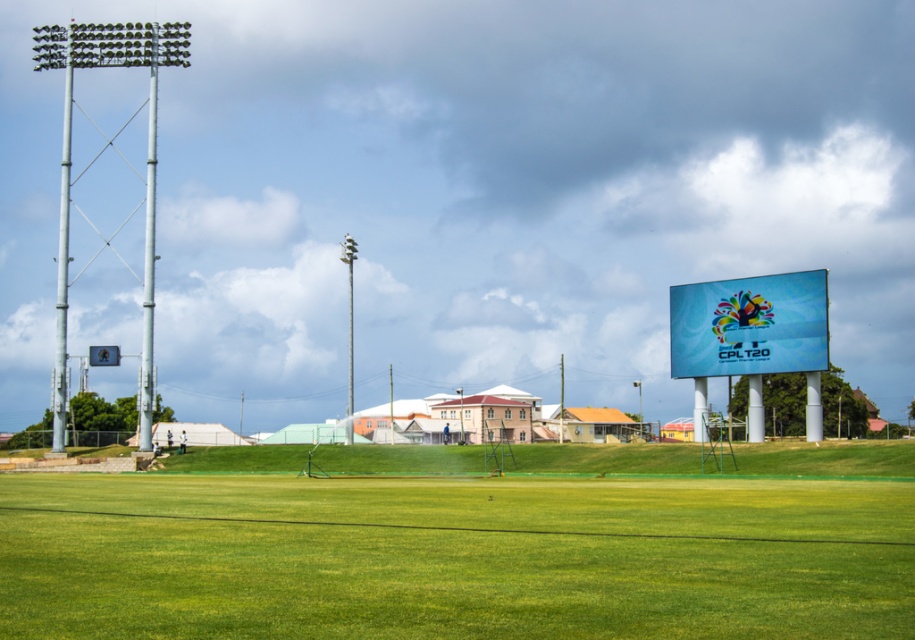
Question: Which of the following is the closest to the observer?

Choices:
 (A) (743, 602)
 (B) (737, 348)

Answer: (A)

Question: Which of the following is the farthest from the observer?

Choices:
 (A) (722, 342)
 (B) (465, 540)

Answer: (A)

Question: Can you confirm if green grass field at center is bigger than blue glossy sign at upper right?

Choices:
 (A) yes
 (B) no

Answer: (A)

Question: Which of the following is the farthest from the observer?

Choices:
 (A) green grass field at center
 (B) blue glossy sign at upper right

Answer: (B)

Question: Can you confirm if green grass field at center is smaller than blue glossy sign at upper right?

Choices:
 (A) yes
 (B) no

Answer: (B)

Question: Observing the image, what is the correct spatial positioning of green grass field at center in reference to blue glossy sign at upper right?

Choices:
 (A) above
 (B) below

Answer: (B)